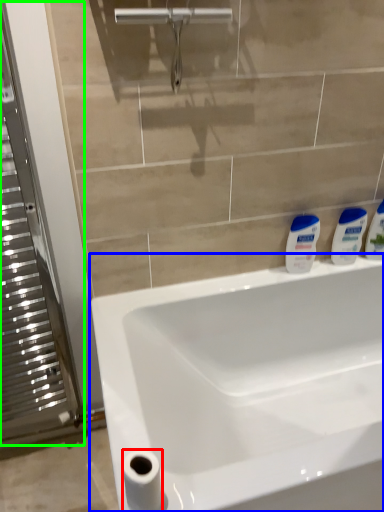
Question: Which object is the closest to the toilet paper (highlighted by a red box)? Choose among these: sink (highlighted by a blue box) or screen door (highlighted by a green box).

Choices:
 (A) sink
 (B) screen door

Answer: (A)